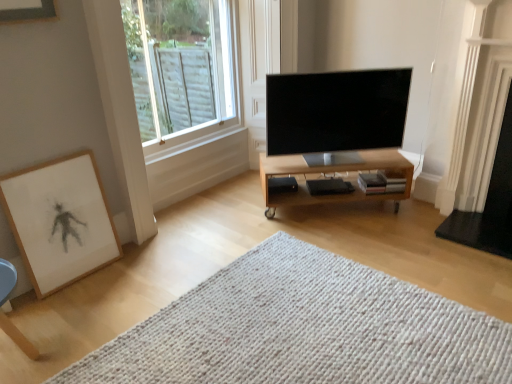
This screenshot has width=512, height=384. What do you see at coordinates (331, 174) in the screenshot? I see `light wood/finished table at center` at bounding box center [331, 174].

Image resolution: width=512 pixels, height=384 pixels. What do you see at coordinates (180, 65) in the screenshot? I see `clear glass window at upper left` at bounding box center [180, 65].

What is the approximate width of white knitted mat at center?

white knitted mat at center is 5.52 feet in width.

At what (x,y) coordinates should I click in order to perform the action: click on matte black tv at center. Please return your answer as a coordinate pair (x, y). Looking at the image, I should click on [x=336, y=111].

What is the approximate width of wooden framed artwork at lower left?

wooden framed artwork at lower left is 2.80 inches wide.

Image resolution: width=512 pixels, height=384 pixels. Identify the location of light wood/finished table at center. (331, 174).

Is point (494, 88) positioned after point (40, 296)?

Yes, it is behind point (40, 296).

Is wooden framed artwork at lower left located within white glossy fireplace at right?

No, wooden framed artwork at lower left is not a part of white glossy fireplace at right.

Is white glossy fireplace at right to the left of wooden framed artwork at lower left from the viewer's perspective?

In fact, white glossy fireplace at right is to the right of wooden framed artwork at lower left.

Based on their sizes in the image, would you say black matte speaker at center is bigger or smaller than matte black tv at center?

black matte speaker at center is smaller than matte black tv at center.

Is black matte speaker at center looking in the opposite direction of matte black tv at center?

No.

Is black matte speaker at center placed right next to matte black tv at center?

black matte speaker at center is not next to matte black tv at center, and they're not touching.

From the image's perspective, which one is positioned higher, black matte speaker at center or matte black tv at center?

matte black tv at center appears higher in the image.

Find the location of `window behind the wooden framed artwork at lower left`. window behind the wooden framed artwork at lower left is located at coordinates (180, 65).

From their relative heights in the image, would you say wooden framed artwork at lower left is taller or shorter than clear glass window at upper left?

Clearly, wooden framed artwork at lower left is shorter compared to clear glass window at upper left.

Which is more to the left, wooden framed artwork at lower left or clear glass window at upper left?

Positioned to the left is wooden framed artwork at lower left.

This screenshot has height=384, width=512. Find the location of `mat below the matte black tv at center (from a real-world perspective)`. mat below the matte black tv at center (from a real-world perspective) is located at coordinates (303, 329).

Considering the sizes of objects matte black tv at center and white knitted mat at center in the image provided, who is smaller, matte black tv at center or white knitted mat at center?

matte black tv at center is smaller.

From a real-world perspective, relative to white knitted mat at center, is matte black tv at center vertically above or below?

matte black tv at center is above white knitted mat at center.

Is clear glass window at upper left facing away from matte black tv at center?

clear glass window at upper left is not turned away from matte black tv at center.

Which point is more distant from viewer, [136,98] or [335,108]?

The point [136,98] is more distant.

Is clear glass window at upper left bigger than matte black tv at center?

Yes.

Is wooden framed artwork at lower left in front of black matte speaker at center?

Yes, it is in front of black matte speaker at center.

Is wooden framed artwork at lower left in contact with black matte speaker at center?

wooden framed artwork at lower left is not next to black matte speaker at center, and they're not touching.

Between wooden framed artwork at lower left and black matte speaker at center, which one has larger width?

Wider between the two is black matte speaker at center.

From the image's perspective, is wooden framed artwork at lower left located beneath black matte speaker at center?

Yes, from the image's perspective, wooden framed artwork at lower left is beneath black matte speaker at center.

Which object is positioned more to the right, black matte speaker at center or white glossy fireplace at right?

white glossy fireplace at right.

Is black matte speaker at center next to white glossy fireplace at right and touching it?

black matte speaker at center is not next to white glossy fireplace at right, and they're not touching.

At what (x,y) coordinates should I click in order to perform the action: click on speaker that appears below the white glossy fireplace at right (from a real-world perspective). Please return your answer as a coordinate pair (x, y). Looking at the image, I should click on (282, 185).

Image resolution: width=512 pixels, height=384 pixels. Find the location of `picture frame on the left of white glossy fireplace at right`. picture frame on the left of white glossy fireplace at right is located at coordinates (60, 220).

I want to click on television in front of the black matte speaker at center, so click(x=336, y=111).

In the scene shown: Looking at the image, which one is located closer to light wood/finished table at center, white knitted mat at center or clear glass window at upper left?

Among the two, white knitted mat at center is located nearer to light wood/finished table at center.

Estimate the real-world distances between objects in this image. Which object is closer to wooden framed artwork at lower left, clear glass window at upper left or white knitted mat at center?

white knitted mat at center is positioned closer to the anchor wooden framed artwork at lower left.

Based on their spatial positions, is wooden framed artwork at lower left or white knitted mat at center closer to light wood/finished table at center?

white knitted mat at center is closer to light wood/finished table at center.

From the image, which object appears to be nearer to black matte speaker at center, white glossy fireplace at right or wooden framed artwork at lower left?

white glossy fireplace at right is closer to black matte speaker at center.

Looking at the image, which one is located further to clear glass window at upper left, black matte speaker at center or matte black tv at center?

black matte speaker at center is positioned further to the anchor clear glass window at upper left.

When comparing their distances from light wood/finished table at center, does white glossy fireplace at right or white knitted mat at center seem further?

white knitted mat at center is positioned further to the anchor light wood/finished table at center.

Estimate the real-world distances between objects in this image. Which object is closer to light wood/finished table at center, clear glass window at upper left or white glossy fireplace at right?

white glossy fireplace at right lies closer to light wood/finished table at center than the other object.

Looking at the image, which one is located further to wooden framed artwork at lower left, matte black tv at center or black matte speaker at center?

The object further to wooden framed artwork at lower left is matte black tv at center.

This screenshot has width=512, height=384. Identify the location of fireplace between white knitted mat at center and light wood/finished table at center in the front-back direction. (488, 184).

This screenshot has width=512, height=384. In order to click on table located between clear glass window at upper left and white glossy fireplace at right in the left-right direction in this screenshot , I will do `click(331, 174)`.

Locate an element on the screen. Image resolution: width=512 pixels, height=384 pixels. window between wooden framed artwork at lower left and light wood/finished table at center in the horizontal direction is located at coordinates (180, 65).

Where is `fireplace between white knitted mat at center and matte black tv at center in the front-back direction`? This screenshot has height=384, width=512. fireplace between white knitted mat at center and matte black tv at center in the front-back direction is located at coordinates (488, 184).